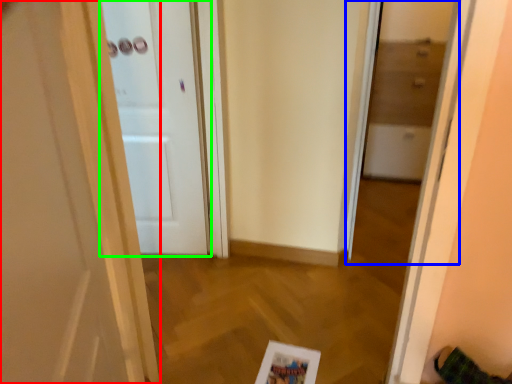
Question: Which object is the farthest from door (highlighted by a red box)? Choose among these: glass door (highlighted by a blue box) or door (highlighted by a green box).

Choices:
 (A) glass door
 (B) door

Answer: (A)